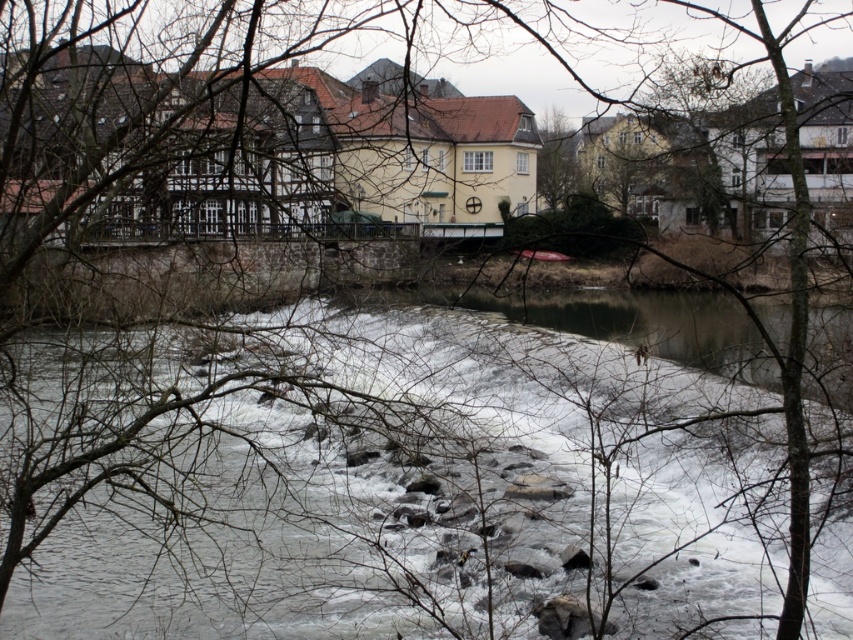
You are an artist sketching the riverside scene. You notice the white frothy water at center and the green leafy tree at upper center. Which object is located to the left of the other?

The white frothy water at center is positioned on the left side of green leafy tree at upper center.

You are an artist painting the riverside scene. You want to ensure that the white frothy water at center and the green leafy tree at upper center are positioned correctly according to their spatial relationship. Which object should appear closer to the viewer?

The white frothy water at center should appear closer to the viewer because it is in front of the green leafy tree at upper center.